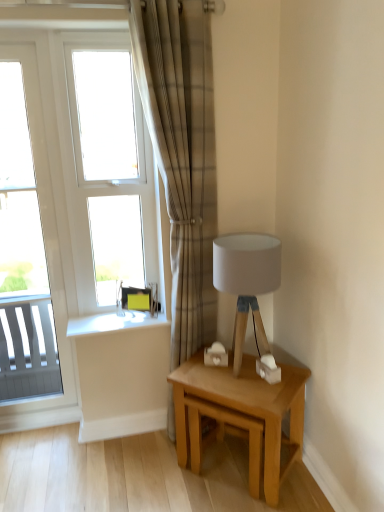
Where is `vacant area situated to the left side of plaid fabric curtain at center`? vacant area situated to the left side of plaid fabric curtain at center is located at coordinates (142, 446).